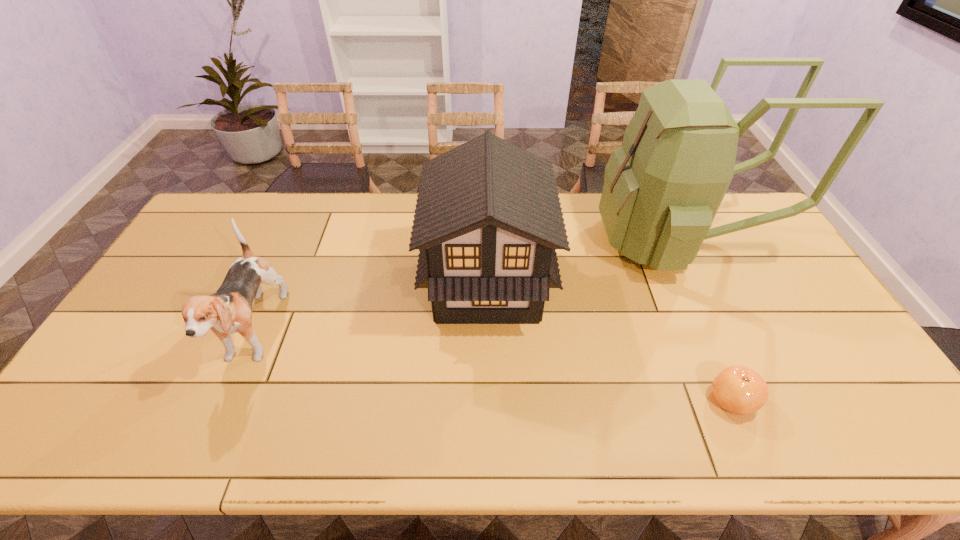
At what (x,y) coordinates should I click in order to perform the action: click on free location at the left edge of the desktop. Please return your answer as a coordinate pair (x, y). The width and height of the screenshot is (960, 540). Looking at the image, I should click on pos(164,327).

In the image, there is a desktop. What are the coordinates of `free space at the right edge` in the screenshot? It's located at (730, 247).

Image resolution: width=960 pixels, height=540 pixels. Identify the location of vacant space at the near left corner. (62, 448).

Identify the location of vacant region between the tallest object and the clementine. (705, 320).

In order to click on free area in between the tallest object and the dollhouse in this screenshot , I will do `click(582, 262)`.

Identify the location of free space between the puppy and the dollhouse. (371, 309).

You are a GUI agent. You are given a task and a screenshot of the screen. Output one action in this format:
    pyautogui.click(x=<x>, y=<y>)
    Task: Click on the vacant space in between the dollhouse and the clementine
    The height and width of the screenshot is (540, 960).
    Given the screenshot: What is the action you would take?
    pyautogui.click(x=610, y=342)

Identify the location of free space between the backpack and the third shortest object. (582, 262).

Where is `empty space between the second tallest object and the tallest object`? Image resolution: width=960 pixels, height=540 pixels. empty space between the second tallest object and the tallest object is located at coordinates (582, 262).

This screenshot has width=960, height=540. I want to click on free spot between the puppy and the second object from left to right, so click(x=371, y=309).